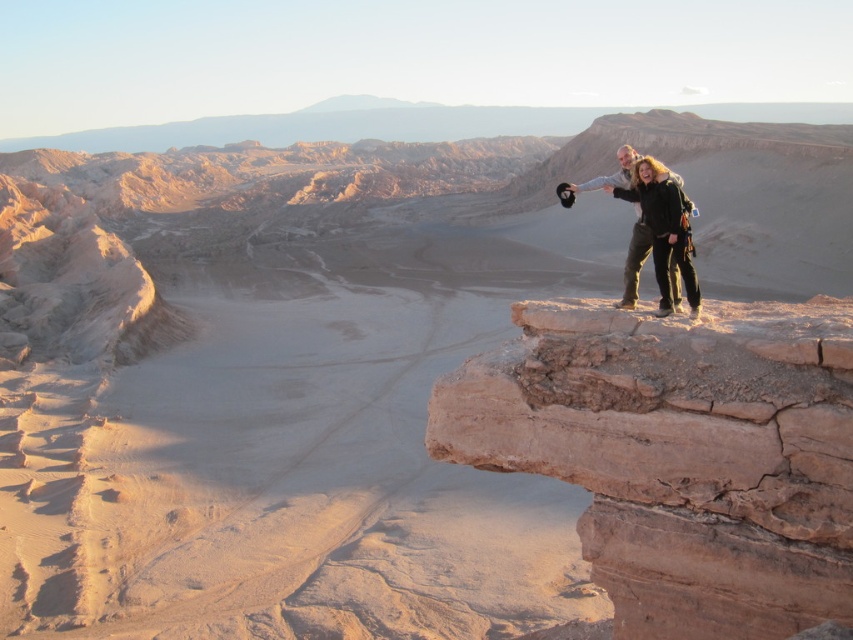
Question: Which of the following is the closest to the observer?

Choices:
 (A) (457, 449)
 (B) (680, 268)

Answer: (A)

Question: Can you confirm if brown rocky cliff at upper right is bigger than dark green pants at right?

Choices:
 (A) yes
 (B) no

Answer: (A)

Question: Which of the following is the farthest from the observer?

Choices:
 (A) brown rocky cliff at upper right
 (B) dark green pants at right

Answer: (B)

Question: Where is brown rocky cliff at upper right located in relation to dark green pants at right in the image?

Choices:
 (A) left
 (B) right

Answer: (A)

Question: Does brown rocky cliff at upper right appear under dark green pants at right?

Choices:
 (A) no
 (B) yes

Answer: (B)